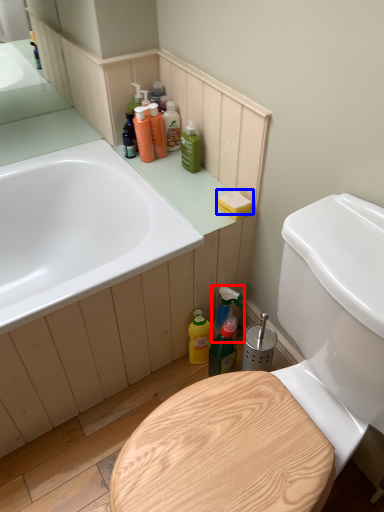
Question: Which of the following is the farthest to the observer, cleaning product (highlighted by a red box) or soap (highlighted by a blue box)?

Choices:
 (A) cleaning product
 (B) soap

Answer: (A)